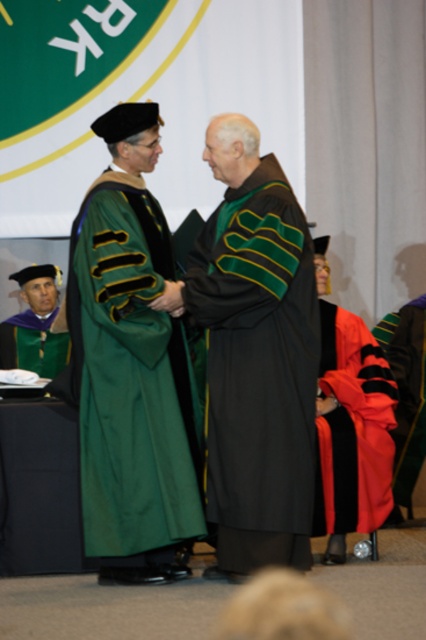
Who is more distant from viewer, (x=393, y=387) or (x=425, y=324)?

The point (x=425, y=324) is more distant.

Who is more distant from viewer, (354,529) or (412,486)?

Positioned behind is point (412,486).

Image resolution: width=426 pixels, height=640 pixels. I want to click on red matte gown at lower right, so click(353, 428).

Can you confirm if red matte gown at lower right is bigger than green matte graduation gown at lower left?

Correct, red matte gown at lower right is larger in size than green matte graduation gown at lower left.

Does red matte gown at lower right appear over green matte graduation gown at lower left?

No.

Who is more forward, (336, 472) or (20, 312)?

Point (336, 472)

Identify the location of red matte gown at lower right. The height and width of the screenshot is (640, 426). (353, 428).

Does black matte gown at center have a larger size compared to green matte graduation gown at lower left?

Correct, black matte gown at center is larger in size than green matte graduation gown at lower left.

Is black matte gown at center above green matte graduation gown at lower left?

Answer: No.

At what (x,y) coordinates should I click in order to perform the action: click on black matte gown at center. Please return your answer as a coordinate pair (x, y). The image size is (426, 640). Looking at the image, I should click on (258, 371).

Where is `black matte gown at center`? black matte gown at center is located at coordinates (258, 371).